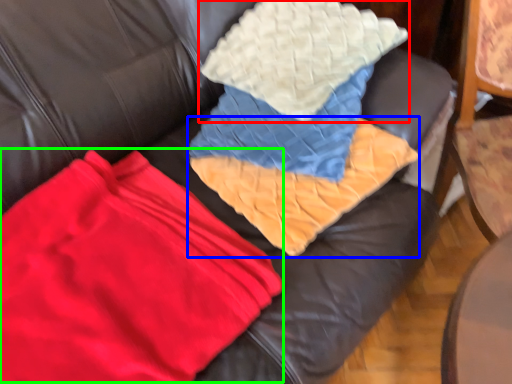
Question: Which object is the farthest from throw pillow (highlighted by a red box)? Choose among these: blanket (highlighted by a blue box) or fabric (highlighted by a green box).

Choices:
 (A) blanket
 (B) fabric

Answer: (B)